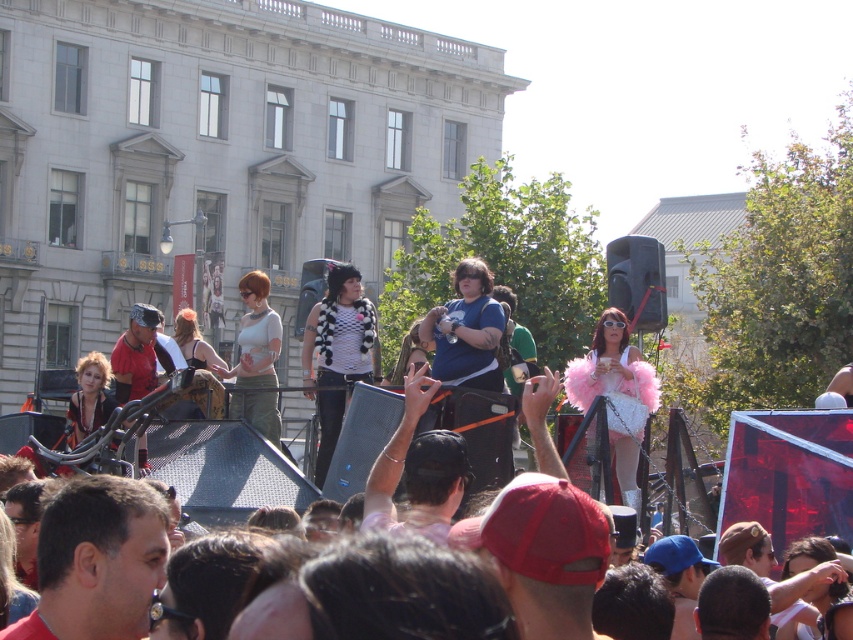
Question: Which object is the farthest from the red fabric cap at center?

Choices:
 (A) dark brown leather jacket at center
 (B) matte black cap at center
 (C) matte red cap at center
 (D) black and white fur vest at center

Answer: (D)

Question: From the image, what is the correct spatial relationship of red fabric cap at center in relation to dark brown leather jacket at center?

Choices:
 (A) right
 (B) left

Answer: (A)

Question: Which object is the closest to the matte red cap at center?

Choices:
 (A) red fabric cap at center
 (B) dark brown leather jacket at center
 (C) matte black cap at center

Answer: (A)

Question: Which of these objects is positioned closest to the matte black cap at center?

Choices:
 (A) black and white fur vest at center
 (B) red fabric cap at center

Answer: (A)

Question: From the image, what is the correct spatial relationship of red fabric cap at center in relation to dark brown leather jacket at center?

Choices:
 (A) below
 (B) above

Answer: (A)

Question: Can you confirm if dark brown leather jacket at center is positioned below black and white fur vest at center?

Choices:
 (A) no
 (B) yes

Answer: (B)